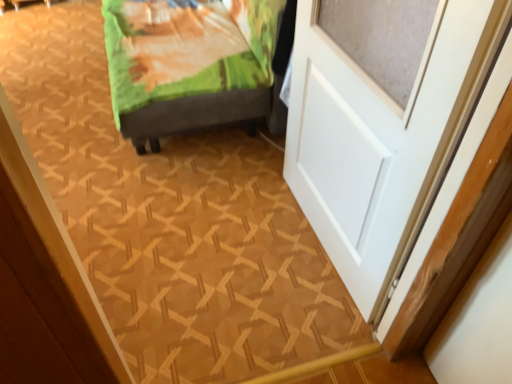
Question: Considering the positions of green fabric bed at upper left and white matte door at right in the image, is green fabric bed at upper left wider or thinner than white matte door at right?

Choices:
 (A) thin
 (B) wide

Answer: (B)

Question: From a real-world perspective, is green fabric bed at upper left physically located above or below white matte door at right?

Choices:
 (A) below
 (B) above

Answer: (A)

Question: Considering the positions of point (161, 39) and point (298, 135), is point (161, 39) closer or farther from the camera than point (298, 135)?

Choices:
 (A) farther
 (B) closer

Answer: (A)

Question: In the image, is white matte door at right positioned in front of or behind green fabric bed at upper left?

Choices:
 (A) front
 (B) behind

Answer: (A)

Question: Is point (457, 51) positioned closer to the camera than point (151, 11)?

Choices:
 (A) closer
 (B) farther

Answer: (A)

Question: From the image's perspective, is white matte door at right above or below green fabric bed at upper left?

Choices:
 (A) above
 (B) below

Answer: (B)

Question: In terms of size, does white matte door at right appear bigger or smaller than green fabric bed at upper left?

Choices:
 (A) small
 (B) big

Answer: (A)